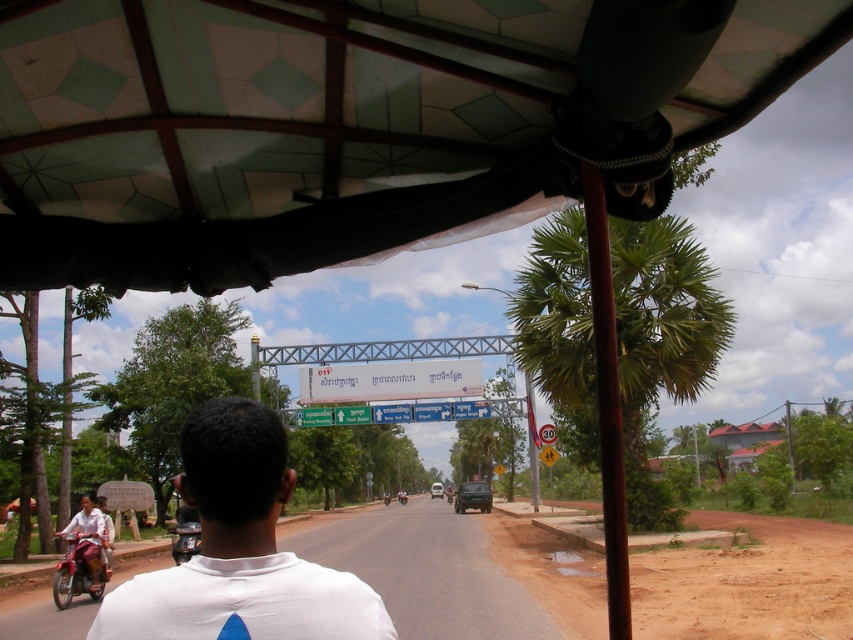
Which is more to the right, white plastic sign at center or metallic silver scooter at lower left?

white plastic sign at center is more to the right.

Image resolution: width=853 pixels, height=640 pixels. In order to click on white plastic sign at center in this screenshot , I will do `click(390, 380)`.

Does point (404, 364) lie behind point (173, 556)?

Yes, it is behind point (173, 556).

The height and width of the screenshot is (640, 853). I want to click on white plastic sign at center, so click(x=390, y=380).

Describe the element at coordinates (354, 124) in the screenshot. The height and width of the screenshot is (640, 853). I see `transparent plastic canopy at upper center` at that location.

What do you see at coordinates (354, 124) in the screenshot? I see `transparent plastic canopy at upper center` at bounding box center [354, 124].

Find the location of `transparent plastic canopy at upper center`. transparent plastic canopy at upper center is located at coordinates (354, 124).

Is green leafy palm tree at right taller than brown dirt track at lower right?

Yes, green leafy palm tree at right is taller than brown dirt track at lower right.

Who is lower down, green leafy palm tree at right or brown dirt track at lower right?

brown dirt track at lower right

You are a GUI agent. You are given a task and a screenshot of the screen. Output one action in this format:
    pyautogui.click(x=<x>, y=<y>)
    Task: Click on the green leafy palm tree at right
    The height and width of the screenshot is (640, 853).
    Given the screenshot: What is the action you would take?
    pyautogui.click(x=660, y=342)

Identify the location of green leafy palm tree at right. The height and width of the screenshot is (640, 853). (660, 342).